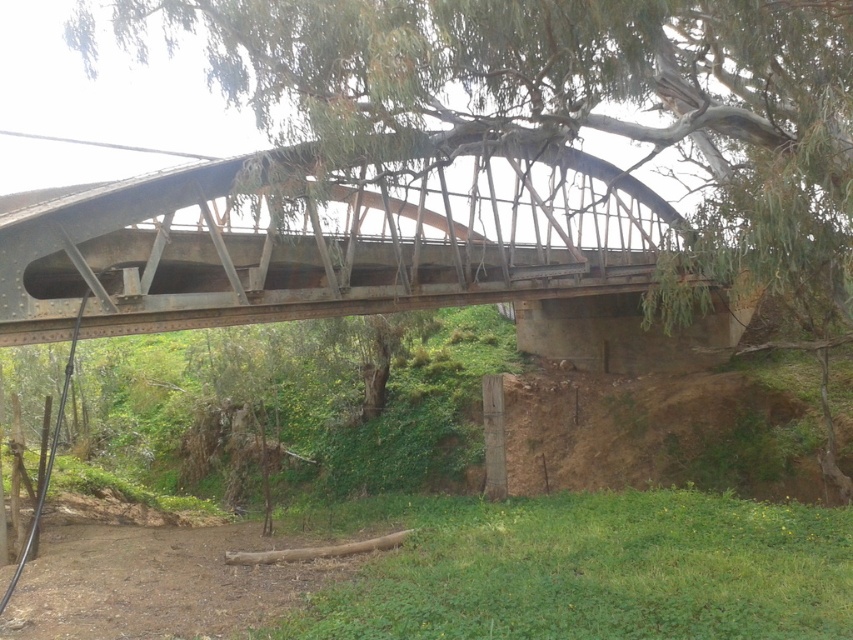
Is green leafy tree at center to the right of rusty metal bridge at center from the viewer's perspective?

Indeed, green leafy tree at center is positioned on the right side of rusty metal bridge at center.

Between point (799, 193) and point (233, 204), which one is positioned in front?

Point (799, 193)

Between point (322, 45) and point (357, 202), which one is positioned behind?

The point (357, 202) is behind.

Where is `green leafy tree at center`? The image size is (853, 640). green leafy tree at center is located at coordinates (581, 115).